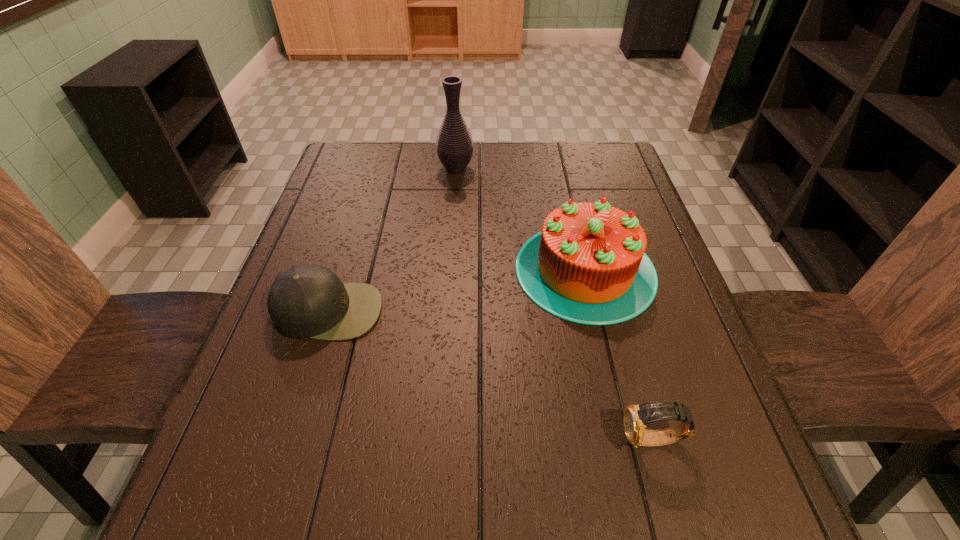
Image resolution: width=960 pixels, height=540 pixels. In order to click on vacant space located on the face of the nearest object in this screenshot , I will do `click(408, 440)`.

Where is `object positioned at the far edge`? object positioned at the far edge is located at coordinates (454, 146).

You are a GUI agent. You are given a task and a screenshot of the screen. Output one action in this format:
    pyautogui.click(x=<x>, y=<y>)
    Task: Click on the object present at the left edge
    This screenshot has height=540, width=960.
    Given the screenshot: What is the action you would take?
    pyautogui.click(x=306, y=301)

Locate an element on the screen. This screenshot has height=540, width=960. cake present at the right edge is located at coordinates (588, 265).

I want to click on watch situated at the right edge, so click(x=636, y=418).

In the image, there is a desktop. Identify the location of free space at the far edge. (535, 168).

The image size is (960, 540). In the image, there is a desktop. What are the coordinates of `blank space at the near edge` in the screenshot? It's located at (436, 529).

Identify the location of free space at the left edge of the desktop. (337, 212).

Find the location of a particular element. This screenshot has width=960, height=540. vacant region at the right edge of the desktop is located at coordinates (736, 437).

Find the location of a particular element. The height and width of the screenshot is (540, 960). vacant space at the far left corner is located at coordinates (357, 181).